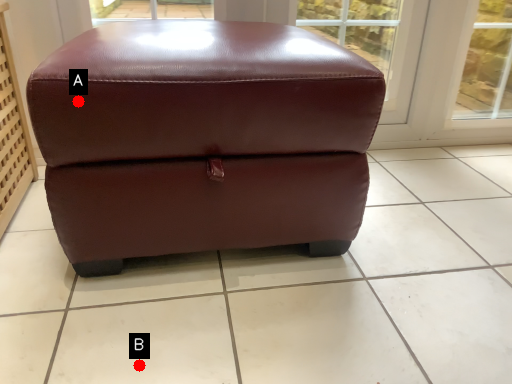
Question: Two points are circled on the image, labeled by A and B beside each circle. Which point is farther from the camera taking this photo?

Choices:
 (A) A is further
 (B) B is further

Answer: (B)